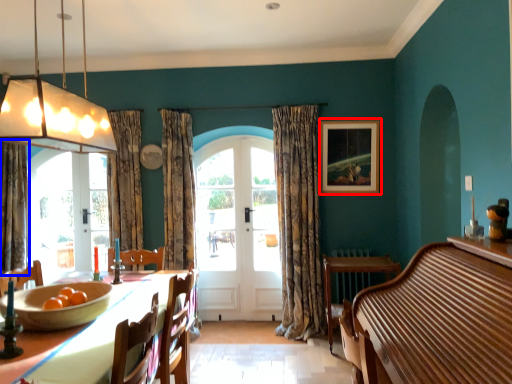
Question: Which of the following is the closest to the observer, picture frame (highlighted by a red box) or curtain (highlighted by a blue box)?

Choices:
 (A) picture frame
 (B) curtain

Answer: (B)